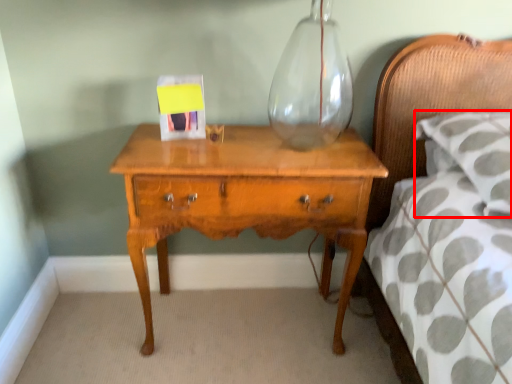
Question: Where is pillow (annotated by the red box) located in relation to nightstand in the image?

Choices:
 (A) left
 (B) right

Answer: (B)